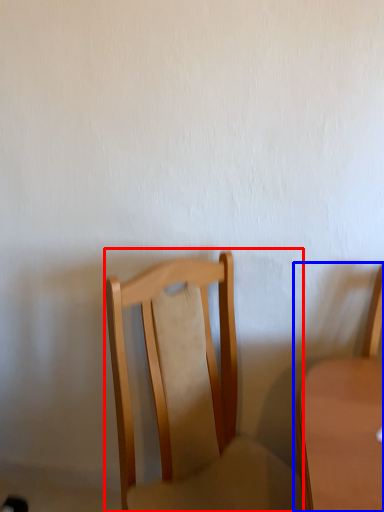
Question: Which object is further to the camera taking this photo, chair (highlighted by a red box) or chair (highlighted by a blue box)?

Choices:
 (A) chair
 (B) chair

Answer: (B)